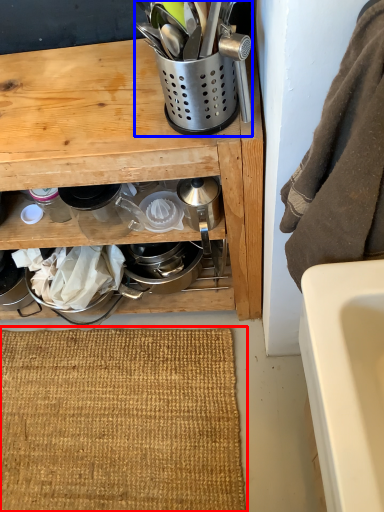
Question: Which of the following is the closest to the observer, doormat (highlighted by a red box) or appliance (highlighted by a blue box)?

Choices:
 (A) doormat
 (B) appliance

Answer: (B)